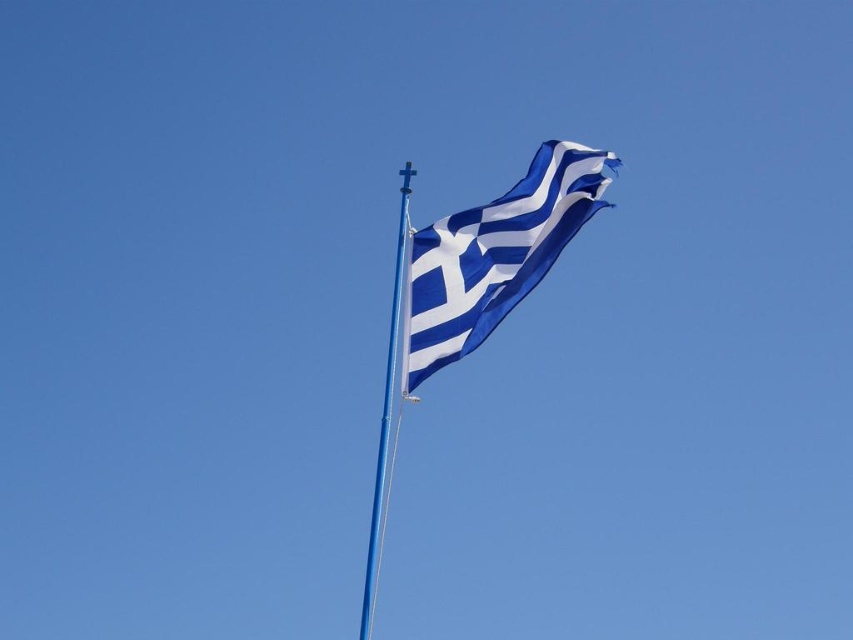
You are a photographer trying to capture the Greek flag. You notice two points on the flag, point [508,227] and point [387,497]. Which point will appear larger in your photo?

Point [508,227] is closer to the camera than point [387,497], so it will appear larger in the photo.